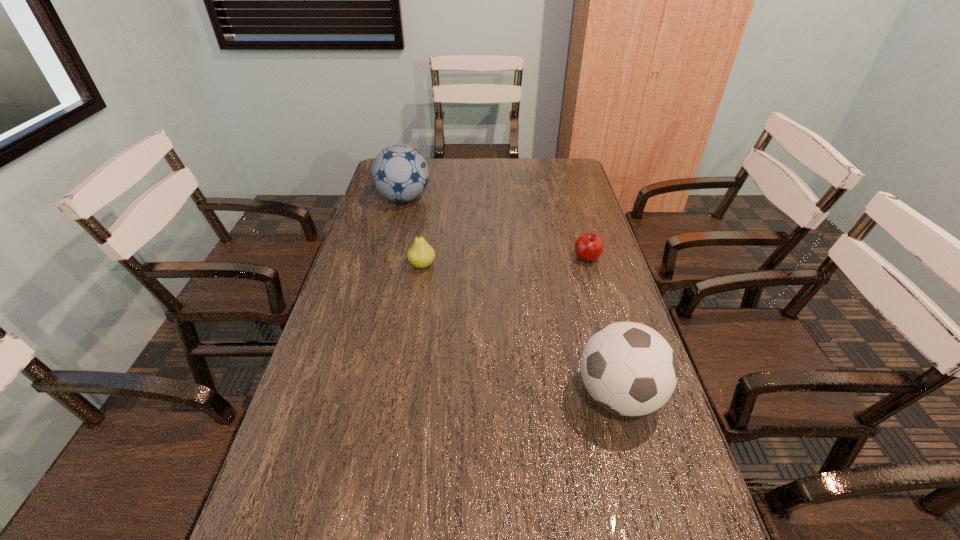
At what (x,y) coordinates should I click in order to perform the action: click on the farther soccer ball. Please return your answer as a coordinate pair (x, y). The image size is (960, 540). Looking at the image, I should click on (400, 173).

Where is `the left soccer ball`? This screenshot has width=960, height=540. the left soccer ball is located at coordinates (400, 173).

Locate an element on the screen. Image resolution: width=960 pixels, height=540 pixels. the nearest object is located at coordinates (628, 368).

Locate an element on the screen. The image size is (960, 540). the nearer soccer ball is located at coordinates (628, 368).

Where is `the third tallest object`? The image size is (960, 540). the third tallest object is located at coordinates (420, 254).

Identify the location of apple. The image size is (960, 540). (588, 247).

The height and width of the screenshot is (540, 960). I want to click on vacant space situated on the side with brand of the left soccer ball, so click(x=535, y=198).

Find the location of a particular element. This screenshot has width=960, height=540. blank space located on the left of the nearest object is located at coordinates (425, 395).

Find the location of a particular element. free spot located 0.170m on the right of the pear is located at coordinates (490, 265).

Locate an element on the screen. free space located on the left of the shortest object is located at coordinates (514, 258).